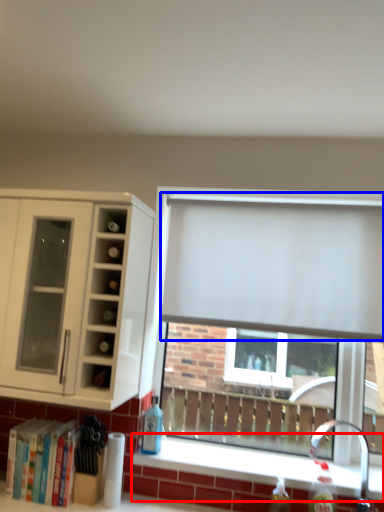
Question: Which of the following is the farthest to the observer, window sill (highlighted by a red box) or curtain (highlighted by a blue box)?

Choices:
 (A) window sill
 (B) curtain

Answer: (B)